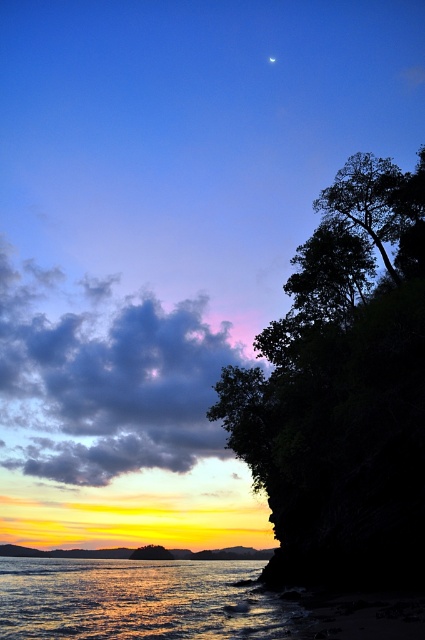
Question: Can you confirm if shiny reflective water at lower left is thinner than green leafy tree at lower center?

Choices:
 (A) no
 (B) yes

Answer: (A)

Question: Which object appears farthest from the camera in this image?

Choices:
 (A) silvery reflective moon at upper center
 (B) shiny reflective water at lower left
 (C) dark green leafy tree at right

Answer: (A)

Question: Is green leafy tree at lower center further to the viewer compared to silvery reflective moon at upper center?

Choices:
 (A) yes
 (B) no

Answer: (B)

Question: Estimate the real-world distances between objects in this image. Which object is farther from the green leafy tree at lower center?

Choices:
 (A) shiny reflective water at lower left
 (B) dark green leafy tree at right

Answer: (B)

Question: Which object is positioned farthest from the silvery reflective moon at upper center?

Choices:
 (A) green leafy tree at lower center
 (B) shiny reflective water at lower left

Answer: (B)

Question: Is shiny reflective water at lower left to the right of green leafy tree at lower center from the viewer's perspective?

Choices:
 (A) yes
 (B) no

Answer: (A)